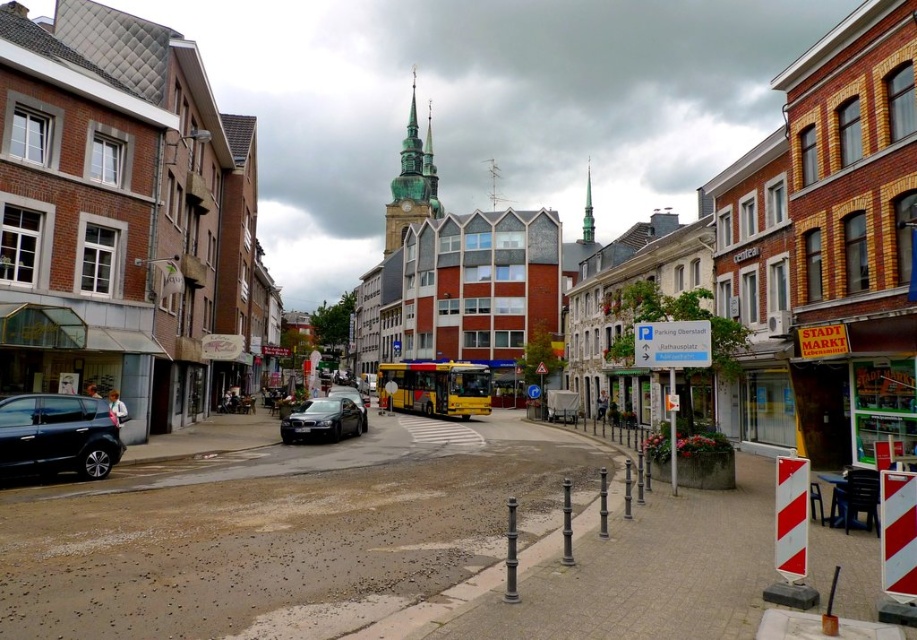
Where is `greenish copper spire at center`? greenish copper spire at center is located at coordinates (412, 180).

Which is more to the left, greenish copper spire at center or shiny black sedan at center?

greenish copper spire at center is more to the left.

Between point (436, 195) and point (302, 417), which one is positioned behind?

The point (436, 195) is more distant.

Image resolution: width=917 pixels, height=640 pixels. I want to click on greenish copper spire at center, so click(412, 180).

Between greenish copper spire at center and satin black sedan at center, which one has more height?

With more height is greenish copper spire at center.

Is point (383, 250) closer to camera compared to point (366, 404)?

No, (383, 250) is further to viewer.

Image resolution: width=917 pixels, height=640 pixels. I want to click on greenish copper spire at center, so click(412, 180).

Between greenish copper spire at center and green copper spire at center, which one has more height?

With more height is greenish copper spire at center.

Does greenish copper spire at center have a lesser width compared to green copper spire at center?

Correct, greenish copper spire at center's width is less than green copper spire at center's.

The height and width of the screenshot is (640, 917). What do you see at coordinates (412, 180) in the screenshot?
I see `greenish copper spire at center` at bounding box center [412, 180].

The image size is (917, 640). I want to click on greenish copper spire at center, so click(412, 180).